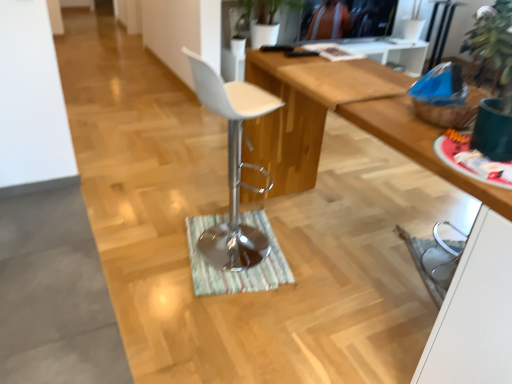
Question: Does wooden desk at center have a greater height compared to white glossy cabinet at lower right?

Choices:
 (A) no
 (B) yes

Answer: (B)

Question: Would you say wooden desk at center is outside white glossy cabinet at lower right?

Choices:
 (A) yes
 (B) no

Answer: (A)

Question: From the image's perspective, does wooden desk at center appear higher than white glossy cabinet at lower right?

Choices:
 (A) yes
 (B) no

Answer: (A)

Question: Can you confirm if wooden desk at center is positioned to the left of white glossy cabinet at lower right?

Choices:
 (A) yes
 (B) no

Answer: (A)

Question: Is wooden desk at center further to camera compared to white glossy cabinet at lower right?

Choices:
 (A) no
 (B) yes

Answer: (B)

Question: In the image, is green striped mat at center on the left side or the right side of wooden desk at center?

Choices:
 (A) left
 (B) right

Answer: (A)

Question: From their relative heights in the image, would you say green striped mat at center is taller or shorter than wooden desk at center?

Choices:
 (A) tall
 (B) short

Answer: (B)

Question: Is point (268, 281) positioned closer to the camera than point (261, 79)?

Choices:
 (A) closer
 (B) farther

Answer: (A)

Question: Is green striped mat at center spatially inside wooden desk at center, or outside of it?

Choices:
 (A) outside
 (B) inside

Answer: (A)

Question: Does point (282, 102) appear closer or farther from the camera than point (482, 352)?

Choices:
 (A) closer
 (B) farther

Answer: (B)

Question: Visually, is white matte bar stool at center positioned to the left or to the right of wooden desk at center?

Choices:
 (A) left
 (B) right

Answer: (A)

Question: Relative to wooden desk at center, is white matte bar stool at center in front or behind?

Choices:
 (A) front
 (B) behind

Answer: (B)

Question: In terms of height, does white matte bar stool at center look taller or shorter compared to wooden desk at center?

Choices:
 (A) short
 (B) tall

Answer: (B)

Question: Looking at the image, does white glossy cabinet at lower right seem bigger or smaller compared to white matte bar stool at center?

Choices:
 (A) big
 (B) small

Answer: (B)

Question: In the image, is white glossy cabinet at lower right on the left side or the right side of white matte bar stool at center?

Choices:
 (A) left
 (B) right

Answer: (B)